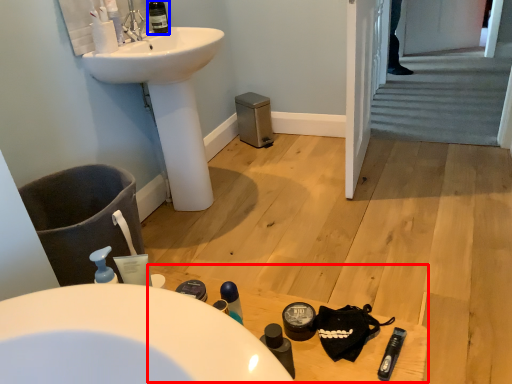
Question: Which point is further to the camera, table (highlighted by a red box) or wine bottle (highlighted by a blue box)?

Choices:
 (A) table
 (B) wine bottle

Answer: (B)